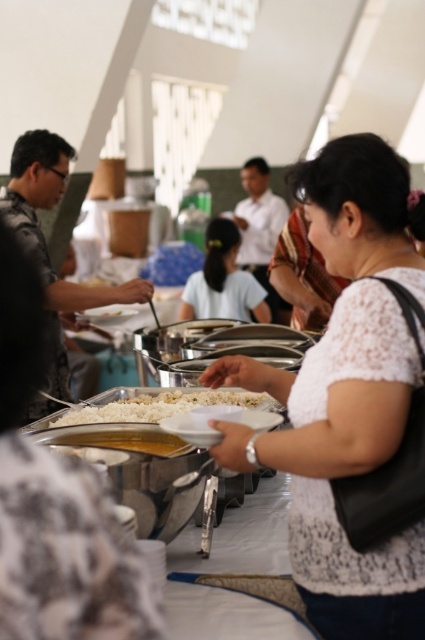
Question: Among these points, which one is farthest from the camera?

Choices:
 (A) (223, 506)
 (B) (359, 620)
 (C) (98, 442)
 (D) (212, 284)

Answer: (D)

Question: Which point appears farthest from the camera in this image?

Choices:
 (A) (105, 420)
 (B) (141, 516)
 (C) (130, 444)

Answer: (A)

Question: Does white lace shirt at center come in front of white rice at center?

Choices:
 (A) no
 (B) yes

Answer: (A)

Question: Considering the relative positions of white matte rice at center and white rice at center in the image provided, where is white matte rice at center located with respect to white rice at center?

Choices:
 (A) left
 (B) right

Answer: (A)

Question: Is white matte rice at center positioned in front of white lace shirt at center?

Choices:
 (A) yes
 (B) no

Answer: (A)

Question: Which point is farther to the camera?

Choices:
 (A) white lace shirt at center
 (B) white rice at center
 (C) white lace blouse at center

Answer: (A)